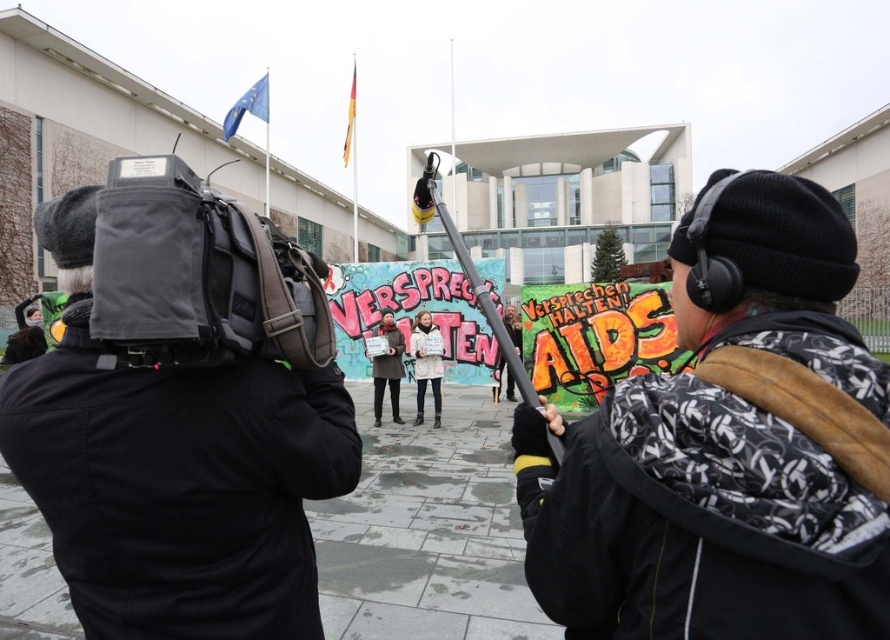
Question: Which is nearer to the black fabric camera at left?

Choices:
 (A) matte black jacket at center
 (B) white cotton coat at center

Answer: (A)

Question: Which object appears farthest from the camera in this image?

Choices:
 (A) black knit cap at upper right
 (B) white cotton coat at center

Answer: (B)

Question: Does white cotton coat at center have a greater width compared to matte black jacket at center?

Choices:
 (A) no
 (B) yes

Answer: (A)

Question: Is white cotton coat at center smaller than matte black jacket at center?

Choices:
 (A) no
 (B) yes

Answer: (B)

Question: Which of these objects is positioned closest to the white cotton coat at center?

Choices:
 (A) matte black jacket at center
 (B) black fabric camera at left
 (C) black knit cap at upper right

Answer: (A)

Question: Does black knit cap at upper right have a lesser width compared to black fabric camera at left?

Choices:
 (A) no
 (B) yes

Answer: (B)